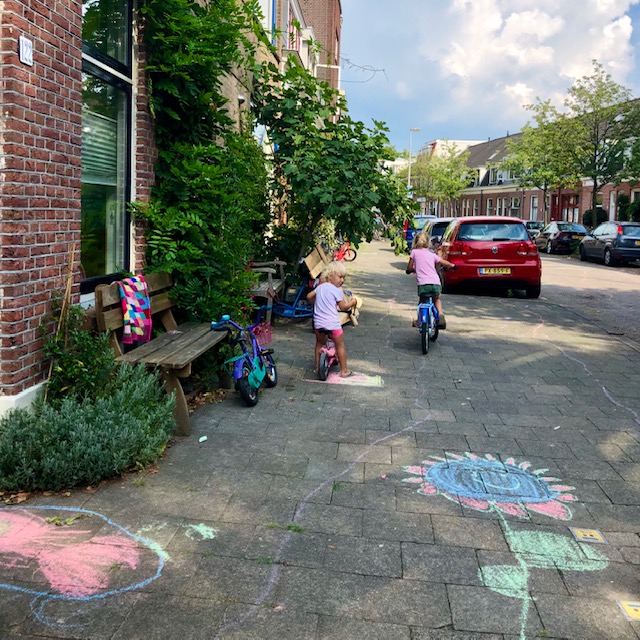
I want to click on red chair, so click(512, 250).